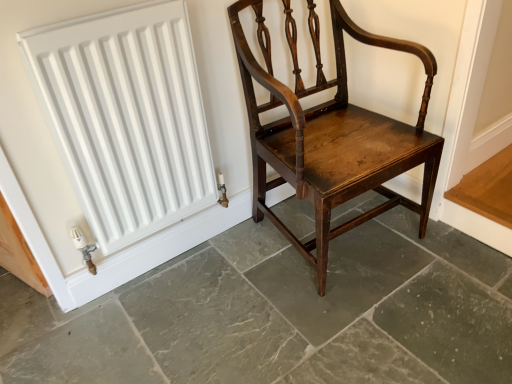
Question: From a real-world perspective, is white matte radiator at upper left on top of dark brown wood chair at center?

Choices:
 (A) no
 (B) yes

Answer: (B)

Question: Does white matte radiator at upper left appear on the left side of dark brown wood chair at center?

Choices:
 (A) yes
 (B) no

Answer: (A)

Question: Is white matte radiator at upper left facing away from dark brown wood chair at center?

Choices:
 (A) yes
 (B) no

Answer: (B)

Question: Does white matte radiator at upper left have a lesser height compared to dark brown wood chair at center?

Choices:
 (A) no
 (B) yes

Answer: (A)

Question: Could you tell me if white matte radiator at upper left is turned towards dark brown wood chair at center?

Choices:
 (A) no
 (B) yes

Answer: (B)

Question: From their relative heights in the image, would you say shiny dark wood chair at center is taller or shorter than white matte radiator at upper left?

Choices:
 (A) tall
 (B) short

Answer: (A)

Question: Looking at the image, does shiny dark wood chair at center seem bigger or smaller compared to white matte radiator at upper left?

Choices:
 (A) small
 (B) big

Answer: (B)

Question: Is point (352, 31) closer or farther from the camera than point (101, 115)?

Choices:
 (A) closer
 (B) farther

Answer: (B)

Question: From a real-world perspective, relative to white matte radiator at upper left, is shiny dark wood chair at center vertically above or below?

Choices:
 (A) above
 (B) below

Answer: (B)

Question: Is shiny dark wood chair at center inside or outside of dark brown wood chair at center?

Choices:
 (A) outside
 (B) inside

Answer: (A)

Question: Considering the positions of shiny dark wood chair at center and dark brown wood chair at center in the image, is shiny dark wood chair at center taller or shorter than dark brown wood chair at center?

Choices:
 (A) tall
 (B) short

Answer: (A)

Question: In the image, is shiny dark wood chair at center on the left side or the right side of dark brown wood chair at center?

Choices:
 (A) left
 (B) right

Answer: (B)

Question: From the image's perspective, is shiny dark wood chair at center located above or below dark brown wood chair at center?

Choices:
 (A) below
 (B) above

Answer: (B)

Question: Is white matte radiator at upper left situated inside dark brown wood chair at center or outside?

Choices:
 (A) inside
 (B) outside

Answer: (B)

Question: Does point (173, 150) appear closer or farther from the camera than point (415, 299)?

Choices:
 (A) farther
 (B) closer

Answer: (B)